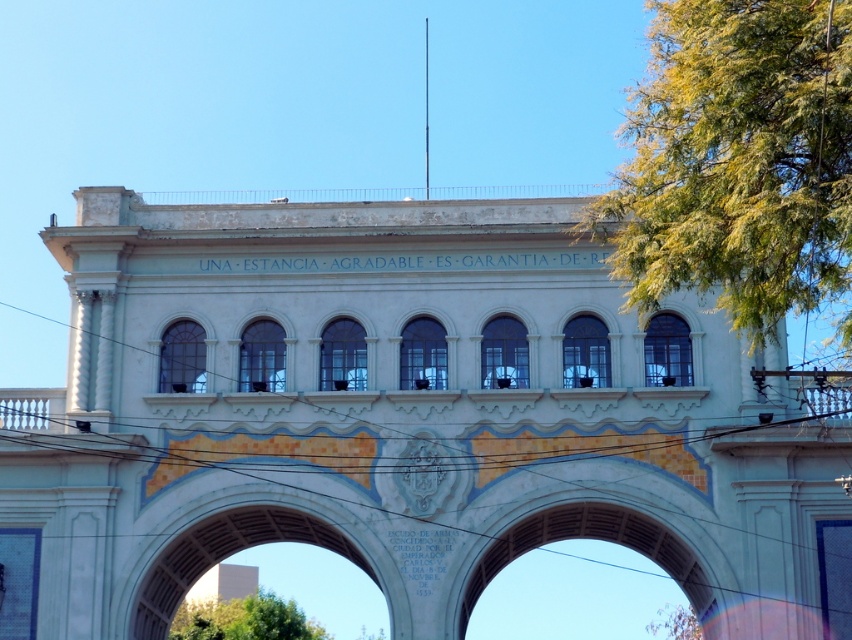
You are standing in front of the grand architectural structure and notice a green leafy tree at lower center. Based on its position, can you determine if the tree is closer to the left or right side of the structure?

The green leafy tree at lower center is located at point (245,620), which places it closer to the right side of the structure.

You are standing in front of the monument and want to take a photo that includes both the green leafy tree at upper right and the green leafy tree at lower center. Which tree should you focus on first to ensure both are in the frame?

You should focus on the green leafy tree at upper right first because it is larger in size than the green leafy tree at lower center, so it will require more space in the frame.